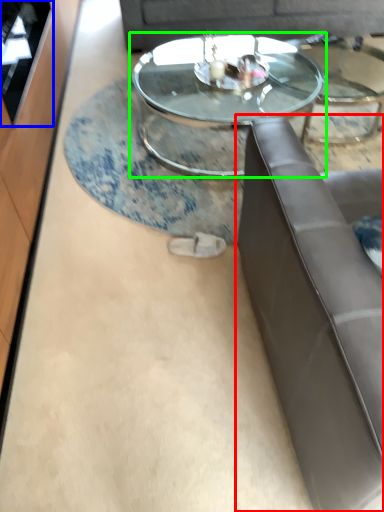
Question: Considering the real-world distances, which object is farthest from studio couch (highlighted by a red box)? glass door (highlighted by a blue box) or coffee table (highlighted by a green box)?

Choices:
 (A) glass door
 (B) coffee table

Answer: (A)